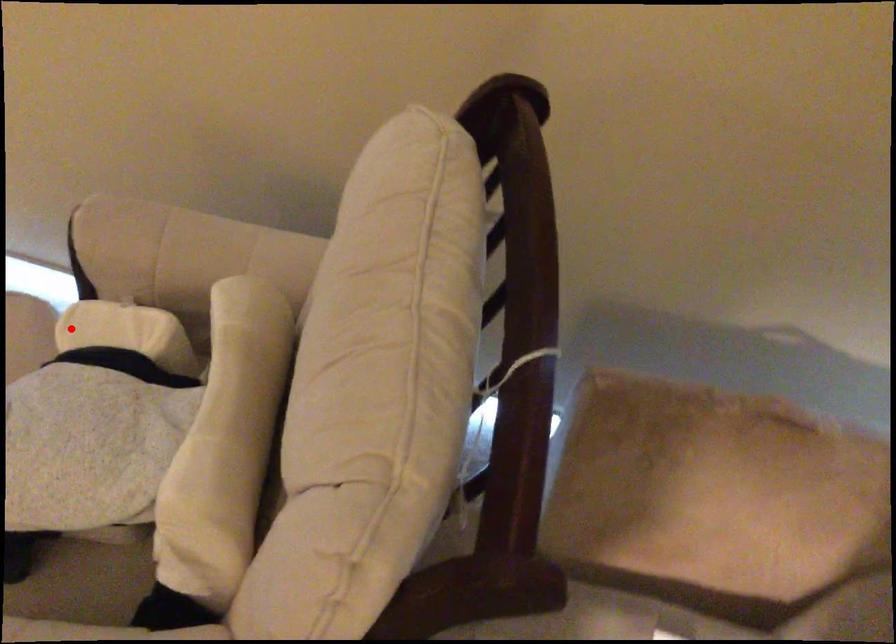
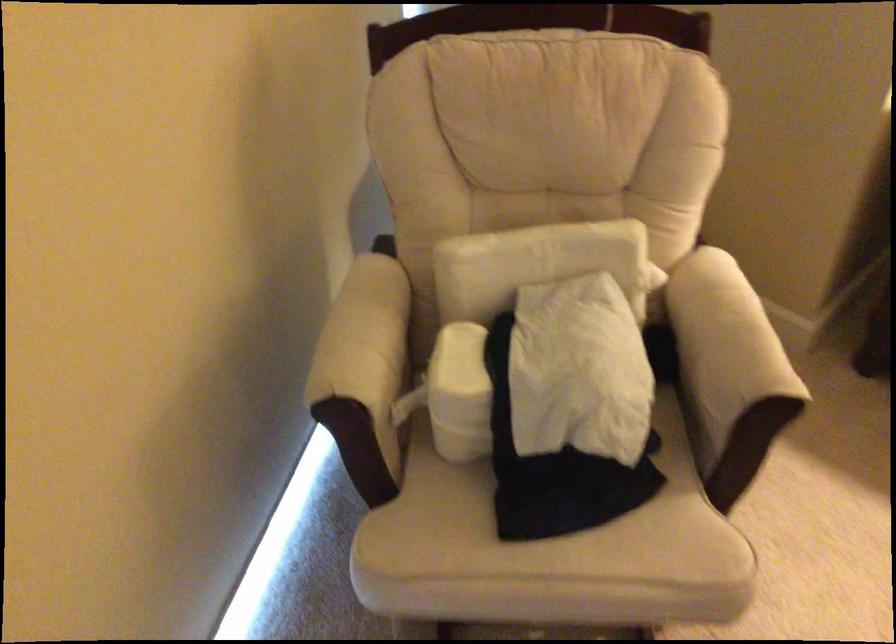
Question: I am providing you with two images of the same scene from different viewpoints. Image1 has a red point marked. In image2, the corresponding 3D location appears at what relative position? Reply with the corresponding letter.

Choices:
 (A) Closer
 (B) Farther

Answer: (B)